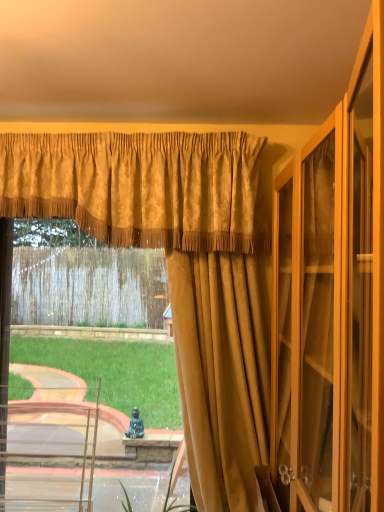
Question: Based on their positions, is suede-like gold curtain at center, which appears as the third curtain when viewed from the back, located to the left or right of gold textured curtain at center, positioned as the 1th curtain in back-to-front order?

Choices:
 (A) left
 (B) right

Answer: (B)

Question: From the image's perspective, relative to gold textured curtain at center, arranged as the third curtain when viewed from the front, is suede-like gold curtain at center, the first curtain viewed from the front, above or below?

Choices:
 (A) below
 (B) above

Answer: (B)

Question: Which of these objects is positioned farthest from the gold textured valance at upper center, which ranks as the 2th curtain in front-to-back order?

Choices:
 (A) suede-like gold curtain at center, the first curtain viewed from the front
 (B) gold textured curtain at center, arranged as the third curtain when viewed from the front

Answer: (A)

Question: Estimate the real-world distances between objects in this image. Which object is farther from the suede-like gold curtain at center, the first curtain viewed from the front?

Choices:
 (A) gold textured valance at upper center, which is the 2th curtain in back-to-front order
 (B) gold textured curtain at center, arranged as the third curtain when viewed from the front

Answer: (A)